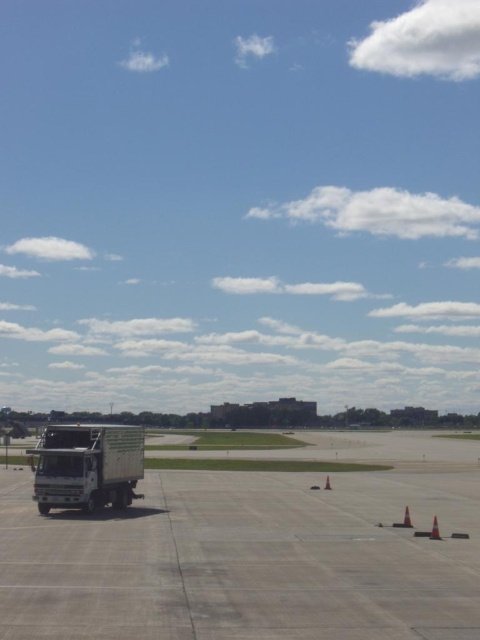
Question: Can you confirm if white glossy truck at lower left is positioned above orange cone at lower right?

Choices:
 (A) no
 (B) yes

Answer: (B)

Question: In this image, where is gray concrete tarmac at lower left located relative to orange matte cone at lower center?

Choices:
 (A) above
 (B) below

Answer: (B)

Question: In this image, where is gray concrete tarmac at lower left located relative to white glossy truck at lower left?

Choices:
 (A) left
 (B) right

Answer: (B)

Question: Which object is positioned farthest from the orange reflective cone at lower right?

Choices:
 (A) gray concrete tarmac at lower left
 (B) white glossy truck at lower left
 (C) orange matte cone at lower center

Answer: (A)

Question: Which object is the farthest from the white glossy truck at lower left?

Choices:
 (A) orange cone at lower right
 (B) orange reflective cone at lower right
 (C) orange matte cone at lower center
 (D) gray concrete tarmac at lower left

Answer: (D)

Question: Which object appears closest to the camera in this image?

Choices:
 (A) orange reflective cone at lower right
 (B) orange cone at lower right

Answer: (B)